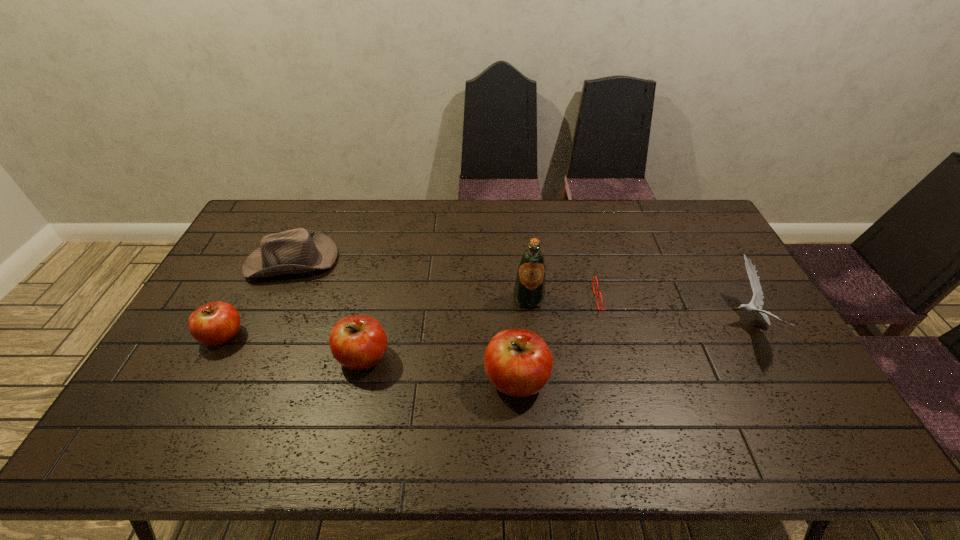
Locate an element on the screen. vacant point located 0.110m on the left of the second tallest apple is located at coordinates (296, 357).

In order to click on free location located on the left of the rightmost apple in this screenshot , I will do `click(388, 380)`.

At what (x,y) coordinates should I click in order to perform the action: click on vacant space located 0.320m on the front-facing side of the sixth object from left to right. Please return your answer as a coordinate pair (x, y). Looking at the image, I should click on (492, 300).

Where is `vacant area situated 0.200m on the front-facing side of the sixth object from left to right`? vacant area situated 0.200m on the front-facing side of the sixth object from left to right is located at coordinates (531, 300).

You are a GUI agent. You are given a task and a screenshot of the screen. Output one action in this format:
    pyautogui.click(x=<x>, y=<y>)
    Task: Click on the free region located on the front-facing side of the sixth object from left to right
    
    Given the screenshot: What is the action you would take?
    pyautogui.click(x=492, y=300)

Where is `vacant space situated 0.310m on the right of the fedora`? vacant space situated 0.310m on the right of the fedora is located at coordinates (429, 260).

In order to click on free region located 0.350m at the tip of the beak of the rightmost object in this screenshot , I will do `click(610, 321)`.

Locate an element on the screen. This screenshot has width=960, height=540. vacant region located at the tip of the beak of the rightmost object is located at coordinates (650, 321).

Locate an element on the screen. free point located 0.400m at the tip of the beak of the rightmost object is located at coordinates (592, 321).

Image resolution: width=960 pixels, height=540 pixels. In order to click on blank space located on the front-facing side of the tallest object in this screenshot , I will do `click(533, 342)`.